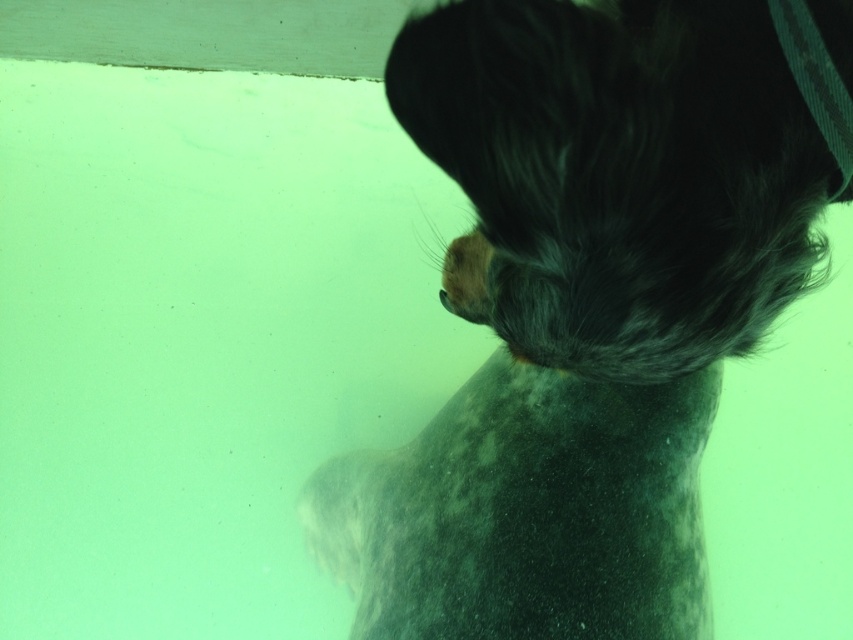
Can you confirm if white fur paw at lower center is positioned above dark blue textured fabric at upper right?

Actually, white fur paw at lower center is below dark blue textured fabric at upper right.

Is white fur paw at lower center to the left of dark blue textured fabric at upper right from the viewer's perspective?

Indeed, white fur paw at lower center is positioned on the left side of dark blue textured fabric at upper right.

The image size is (853, 640). Identify the location of white fur paw at lower center. pos(343,512).

Does fluffy gray dog at upper right appear under white fur paw at lower center?

No, fluffy gray dog at upper right is not below white fur paw at lower center.

The width and height of the screenshot is (853, 640). I want to click on fluffy gray dog at upper right, so click(x=590, y=305).

Locate an element on the screen. The width and height of the screenshot is (853, 640). fluffy gray dog at upper right is located at coordinates (590, 305).

Is fluffy gray dog at upper right closer to camera compared to dark blue textured fabric at upper right?

Yes, it is in front of dark blue textured fabric at upper right.

Who is positioned more to the right, fluffy gray dog at upper right or dark blue textured fabric at upper right?

From the viewer's perspective, dark blue textured fabric at upper right appears more on the right side.

Identify the location of fluffy gray dog at upper right. (590, 305).